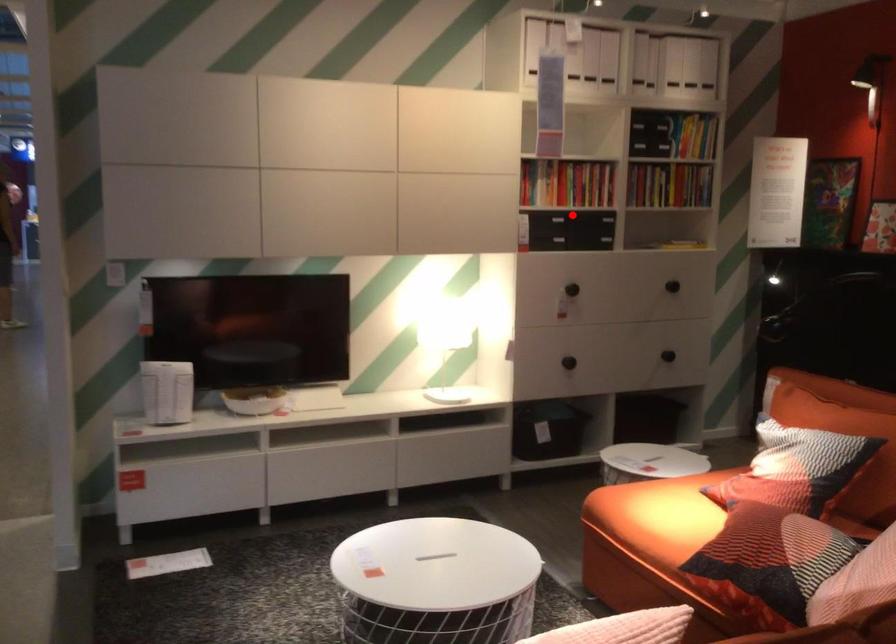
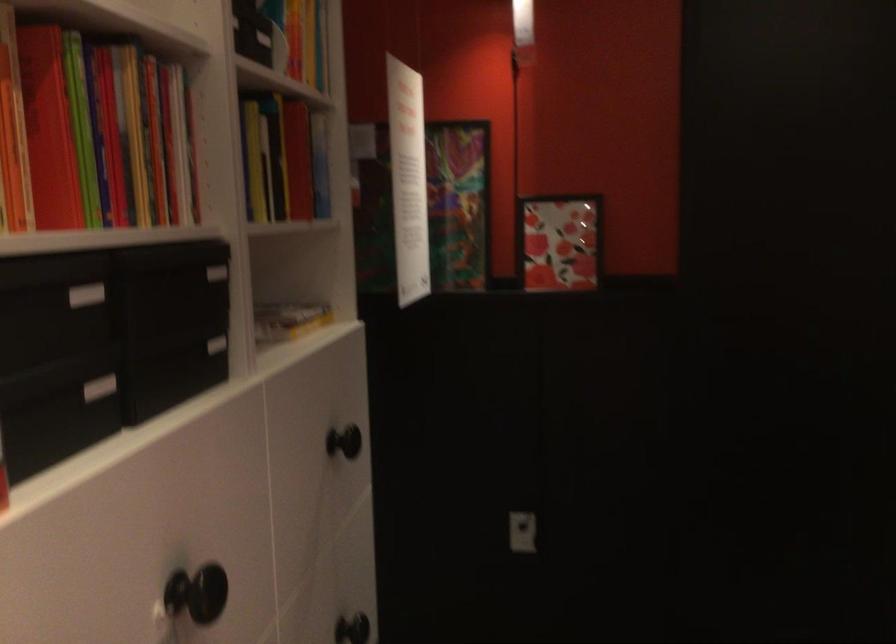
Question: I am providing you with two images of the same scene from different viewpoints. A red point is shown in image1. For the corresponding object point in image2, is it positioned nearer or farther from the camera?

Choices:
 (A) Nearer
 (B) Farther

Answer: (A)